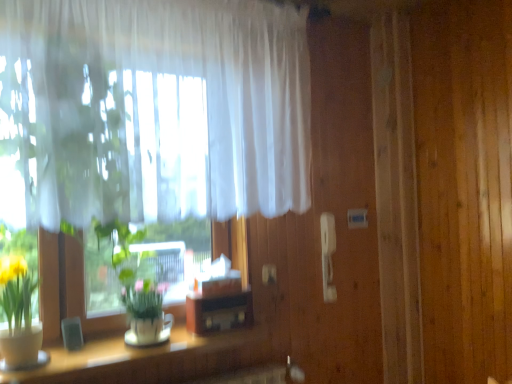
The height and width of the screenshot is (384, 512). Identify the location of vacant region above wooden table at lower left (from a real-world perspective). (128, 347).